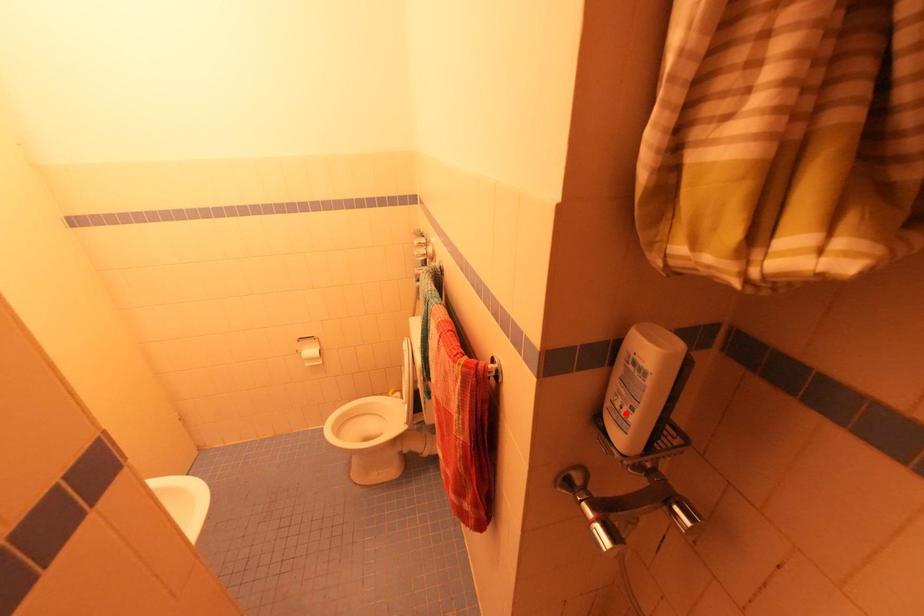
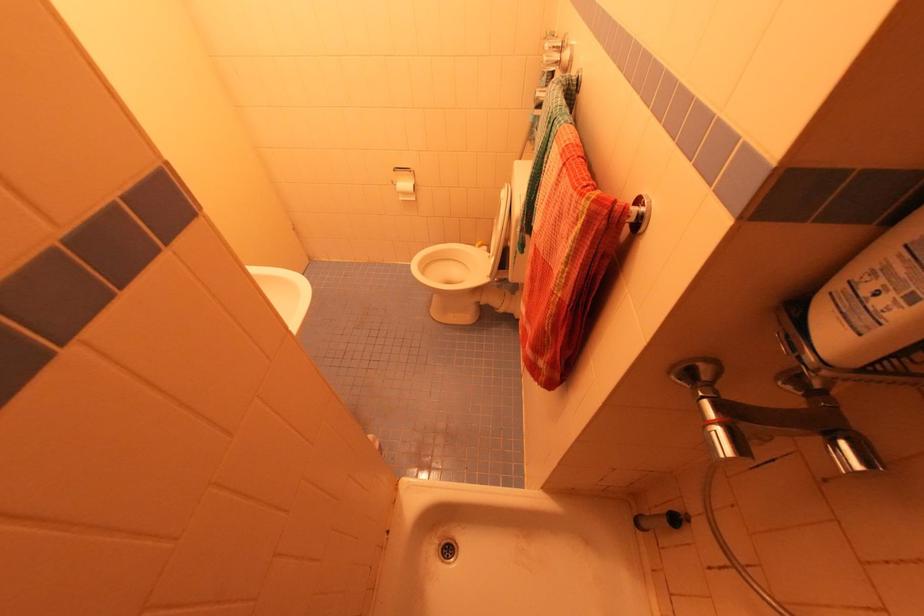
In the second image, find the point that corresponds to the highlighted location in the first image.

(881, 302)